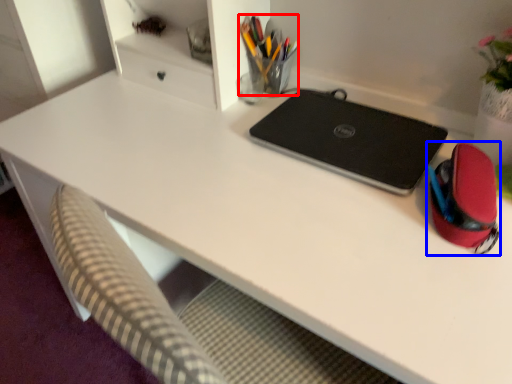
Question: Which object is closer to the camera taking this photo, stationery (highlighted by a red box) or stationery (highlighted by a blue box)?

Choices:
 (A) stationery
 (B) stationery

Answer: (B)